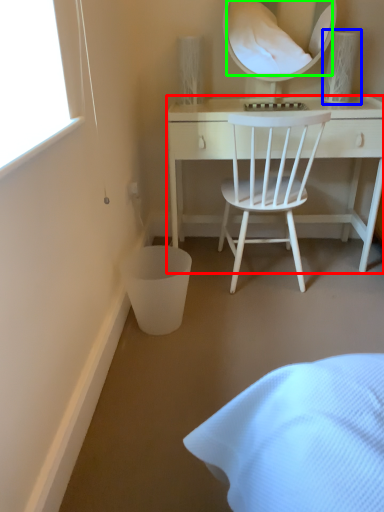
Question: Considering the real-world distances, which object is closest to desk (highlighted by a red box)? table lamp (highlighted by a blue box) or mirror (highlighted by a green box).

Choices:
 (A) table lamp
 (B) mirror

Answer: (A)